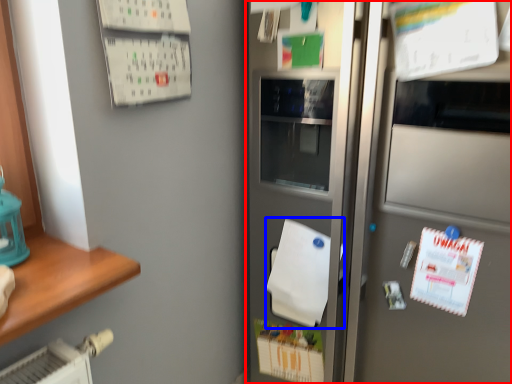
Question: Which of the following is the farthest to the observer, refrigerator (highlighted by a red box) or wrapping paper (highlighted by a blue box)?

Choices:
 (A) refrigerator
 (B) wrapping paper

Answer: (B)